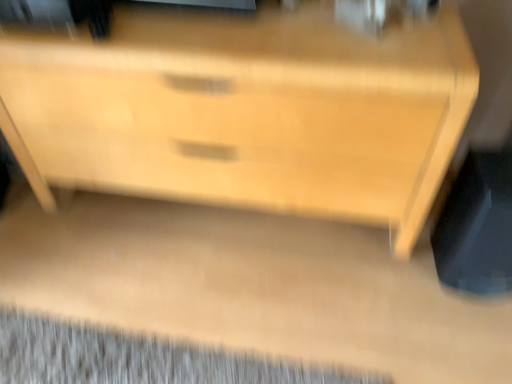
Question: Does gray textured mat at lower left have a greater width compared to black plastic swivel chair at lower right?

Choices:
 (A) no
 (B) yes

Answer: (B)

Question: Is gray textured mat at lower left not within black plastic swivel chair at lower right?

Choices:
 (A) yes
 (B) no

Answer: (A)

Question: Is gray textured mat at lower left to the left of black plastic swivel chair at lower right from the viewer's perspective?

Choices:
 (A) yes
 (B) no

Answer: (A)

Question: Is gray textured mat at lower left positioned far away from black plastic swivel chair at lower right?

Choices:
 (A) yes
 (B) no

Answer: (B)

Question: From the image's perspective, is gray textured mat at lower left below black plastic swivel chair at lower right?

Choices:
 (A) no
 (B) yes

Answer: (B)

Question: Considering the positions of gray textured mat at lower left and black plastic swivel chair at lower right in the image, is gray textured mat at lower left taller or shorter than black plastic swivel chair at lower right?

Choices:
 (A) tall
 (B) short

Answer: (B)

Question: Based on their sizes in the image, would you say gray textured mat at lower left is bigger or smaller than black plastic swivel chair at lower right?

Choices:
 (A) big
 (B) small

Answer: (B)

Question: Is point (37, 367) closer or farther from the camera than point (487, 258)?

Choices:
 (A) farther
 (B) closer

Answer: (B)

Question: In the image, is gray textured mat at lower left positioned in front of or behind black plastic swivel chair at lower right?

Choices:
 (A) front
 (B) behind

Answer: (B)

Question: Considering the positions of light wood chest of drawers at center and black plastic swivel chair at lower right in the image, is light wood chest of drawers at center bigger or smaller than black plastic swivel chair at lower right?

Choices:
 (A) big
 (B) small

Answer: (A)

Question: From a real-world perspective, is light wood chest of drawers at center positioned above or below black plastic swivel chair at lower right?

Choices:
 (A) above
 (B) below

Answer: (A)

Question: From the image's perspective, is light wood chest of drawers at center positioned above or below black plastic swivel chair at lower right?

Choices:
 (A) above
 (B) below

Answer: (A)

Question: In the image, is light wood chest of drawers at center positioned in front of or behind black plastic swivel chair at lower right?

Choices:
 (A) behind
 (B) front

Answer: (B)

Question: Based on their sizes in the image, would you say light wood chest of drawers at center is bigger or smaller than gray textured mat at lower left?

Choices:
 (A) big
 (B) small

Answer: (A)

Question: Is light wood chest of drawers at center wider or thinner than gray textured mat at lower left?

Choices:
 (A) thin
 (B) wide

Answer: (A)